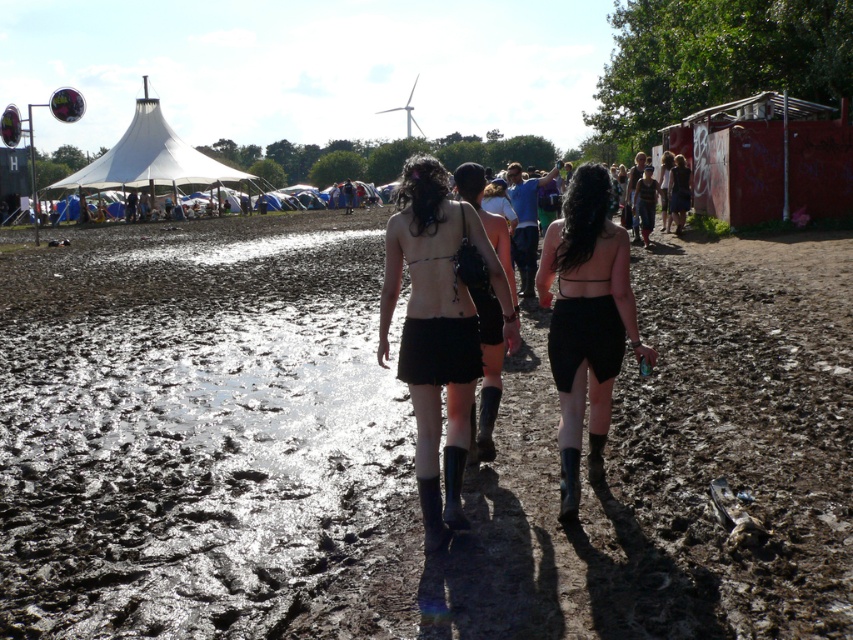
Question: Can you confirm if muddy wet ground at center is positioned to the right of black matte shorts at center?

Choices:
 (A) no
 (B) yes

Answer: (A)

Question: Which of these objects is positioned closest to the black matte skirt at center?

Choices:
 (A) muddy wet ground at center
 (B) black matte shorts at center
 (C) matte black skirt at center
 (D) white canvas tent at upper left

Answer: (C)

Question: Is the position of matte black skirt at center less distant than that of black matte shorts at center?

Choices:
 (A) no
 (B) yes

Answer: (B)

Question: Which point is farther to the camera?

Choices:
 (A) (154, 116)
 (B) (587, 236)
 (C) (428, 388)

Answer: (A)

Question: Which point appears farthest from the camera in this image?

Choices:
 (A) (525, 428)
 (B) (419, 202)

Answer: (A)

Question: Does black matte shorts at center appear over white canvas tent at upper left?

Choices:
 (A) yes
 (B) no

Answer: (B)